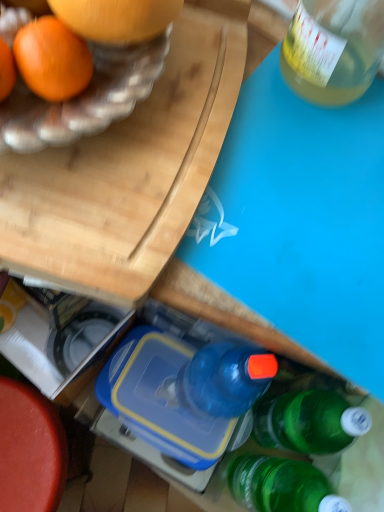
Image resolution: width=384 pixels, height=512 pixels. In order to click on vacant point above blue plastic lunch box at center (from a real-world perspective) in this screenshot , I will do (145, 392).